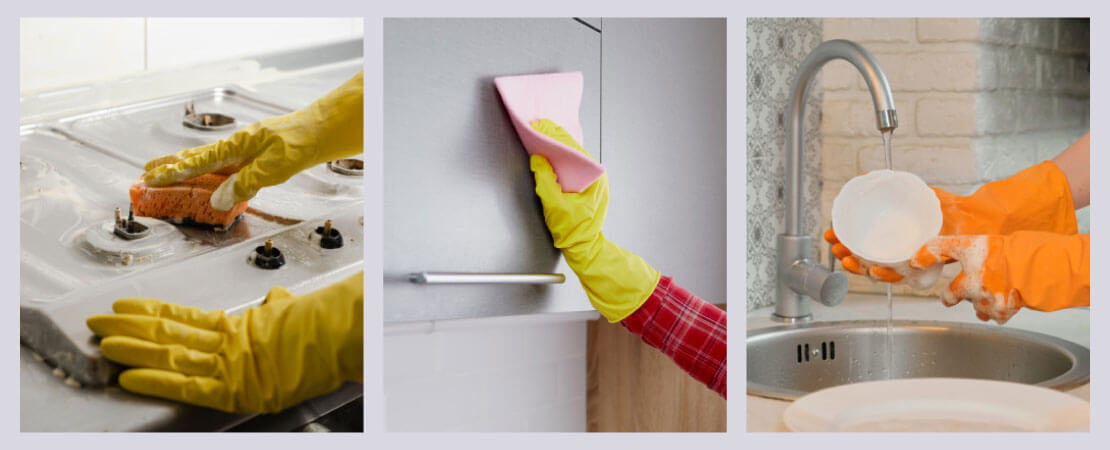
At what (x,y) coordinates should I click in order to perform the action: click on white plate. Please return your answer as a coordinate pair (x, y). Looking at the image, I should click on (944, 411).